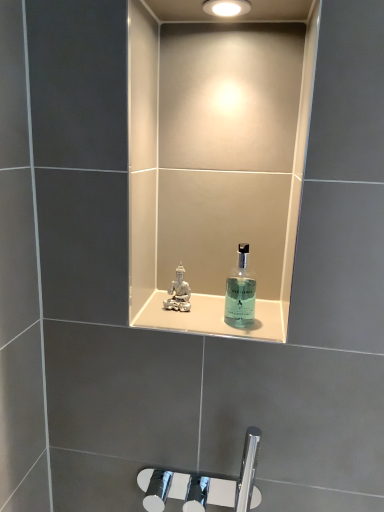
The height and width of the screenshot is (512, 384). Find the location of `free location to the left of transparent glass bottle at center`. free location to the left of transparent glass bottle at center is located at coordinates (184, 323).